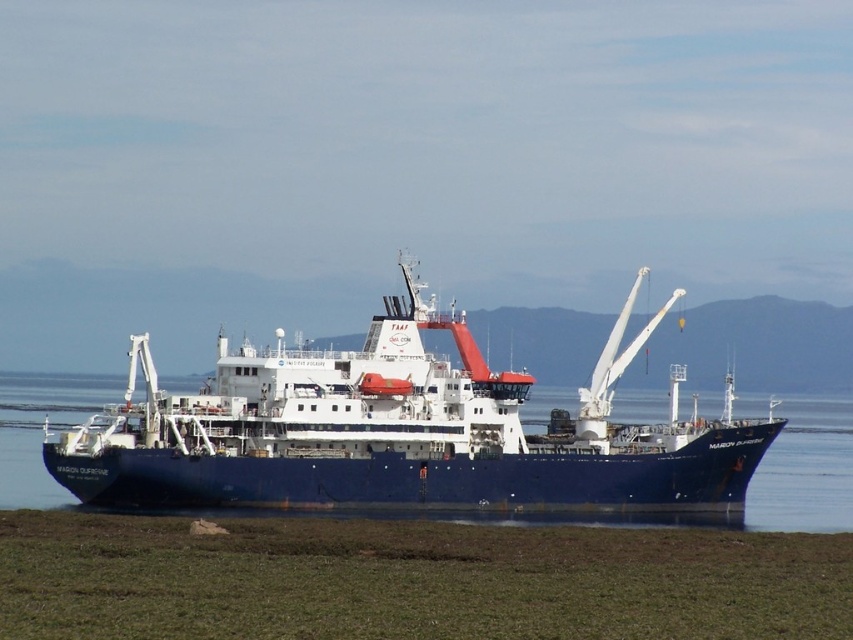
You are a photographer standing on the shore. You want to capture a clear photo of the blue matte ship at center without any reflections from the blue glossy water at center. Is the ship currently positioned in a way that allows this?

The blue matte ship at center is positioned over blue glossy water at center, so it is sitting directly on top of the water. This means the water beneath it would reflect the ship, making it difficult to avoid reflections in the photo.

You are standing at the origin point of the coordinate system in the image. The origin is at the bottom left corner of the image. You want to move towards the blue matte ship at center. In which general direction should you move?

Since the blue matte ship at center is located at coordinate point (399,432), which is to the upper right from the origin at the bottom left corner, you should move in the upper right direction to reach the blue matte ship at center.